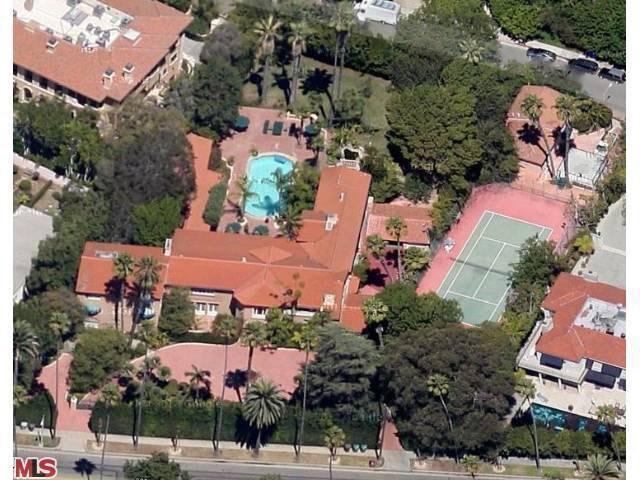
In order to click on chimneys in this screenshot , I will do `click(112, 75)`, `click(131, 74)`.